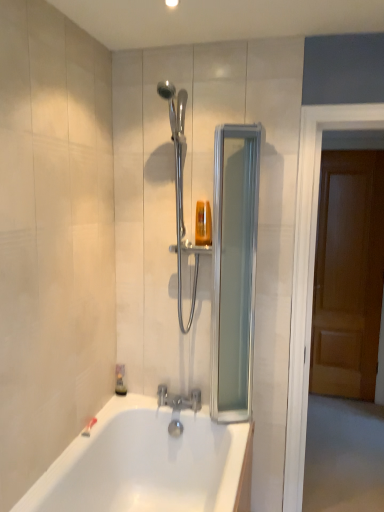
Question: Can you confirm if silver metallic faucet at lower center is thinner than translucent plastic soap dispenser at lower left?

Choices:
 (A) no
 (B) yes

Answer: (A)

Question: Is silver metallic faucet at lower center facing towards translucent plastic soap dispenser at lower left?

Choices:
 (A) yes
 (B) no

Answer: (B)

Question: Are silver metallic faucet at lower center and translucent plastic soap dispenser at lower left far apart?

Choices:
 (A) yes
 (B) no

Answer: (B)

Question: Can you confirm if silver metallic faucet at lower center is taller than translucent plastic soap dispenser at lower left?

Choices:
 (A) yes
 (B) no

Answer: (B)

Question: Considering the relative sizes of silver metallic faucet at lower center and translucent plastic soap dispenser at lower left in the image provided, is silver metallic faucet at lower center bigger than translucent plastic soap dispenser at lower left?

Choices:
 (A) no
 (B) yes

Answer: (B)

Question: Would you say wooden door at right, arranged as the 1th screen door when viewed from the right, is inside or outside silver metallic faucet at lower center?

Choices:
 (A) inside
 (B) outside

Answer: (B)

Question: Based on their sizes in the image, would you say wooden door at right, arranged as the 1th screen door when viewed from the right, is bigger or smaller than silver metallic faucet at lower center?

Choices:
 (A) small
 (B) big

Answer: (B)

Question: Considering the positions of wooden door at right, the second screen door in the left-to-right sequence, and silver metallic faucet at lower center in the image, is wooden door at right, the second screen door in the left-to-right sequence, taller or shorter than silver metallic faucet at lower center?

Choices:
 (A) short
 (B) tall

Answer: (B)

Question: From a real-world perspective, is wooden door at right, the second screen door in the left-to-right sequence, physically located above or below silver metallic faucet at lower center?

Choices:
 (A) below
 (B) above

Answer: (B)

Question: From their relative heights in the image, would you say silver metallic faucet at lower center is taller or shorter than translucent plastic soap dispenser at upper center?

Choices:
 (A) short
 (B) tall

Answer: (A)

Question: Is silver metallic faucet at lower center wider or thinner than translucent plastic soap dispenser at upper center?

Choices:
 (A) wide
 (B) thin

Answer: (A)

Question: Is point (185, 397) positioned closer to the camera than point (195, 241)?

Choices:
 (A) farther
 (B) closer

Answer: (A)

Question: From the image's perspective, relative to translucent plastic soap dispenser at upper center, is silver metallic faucet at lower center above or below?

Choices:
 (A) above
 (B) below

Answer: (B)

Question: Looking at the image, does translucent plastic soap dispenser at lower left seem bigger or smaller compared to translucent plastic soap dispenser at upper center?

Choices:
 (A) big
 (B) small

Answer: (B)

Question: Relative to translucent plastic soap dispenser at upper center, is translucent plastic soap dispenser at lower left in front or behind?

Choices:
 (A) behind
 (B) front

Answer: (A)